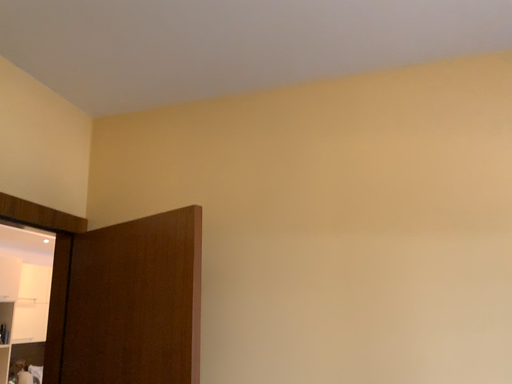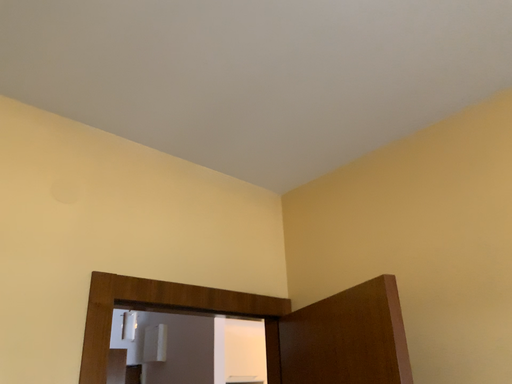
Question: How did the camera likely rotate when shooting the video?

Choices:
 (A) rotated right
 (B) rotated left

Answer: (B)